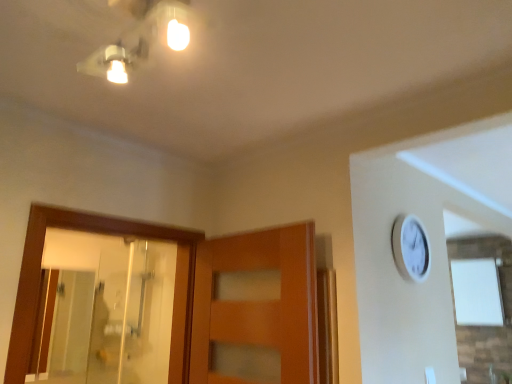
Question: From a real-world perspective, relative to matte white light fixture at upper center, is transparent glass mirror at left vertically above or below?

Choices:
 (A) above
 (B) below

Answer: (B)

Question: Is transparent glass mirror at left inside or outside of matte white light fixture at upper center?

Choices:
 (A) outside
 (B) inside

Answer: (A)

Question: Is point (117, 264) closer or farther from the camera than point (147, 51)?

Choices:
 (A) farther
 (B) closer

Answer: (A)

Question: From the image's perspective, is matte white light fixture at upper center positioned above or below transparent glass mirror at left?

Choices:
 (A) above
 (B) below

Answer: (A)

Question: From their relative heights in the image, would you say matte white light fixture at upper center is taller or shorter than transparent glass mirror at left?

Choices:
 (A) tall
 (B) short

Answer: (B)

Question: Is matte white light fixture at upper center inside or outside of transparent glass mirror at left?

Choices:
 (A) inside
 (B) outside

Answer: (B)

Question: In the image, is matte white light fixture at upper center positioned in front of or behind transparent glass mirror at left?

Choices:
 (A) behind
 (B) front

Answer: (B)